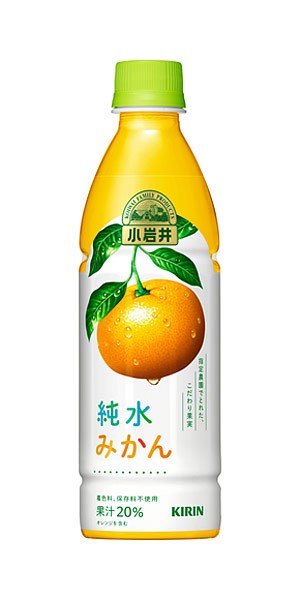
This screenshot has width=301, height=600. In order to click on bottle in this screenshot , I will do `click(161, 403)`.